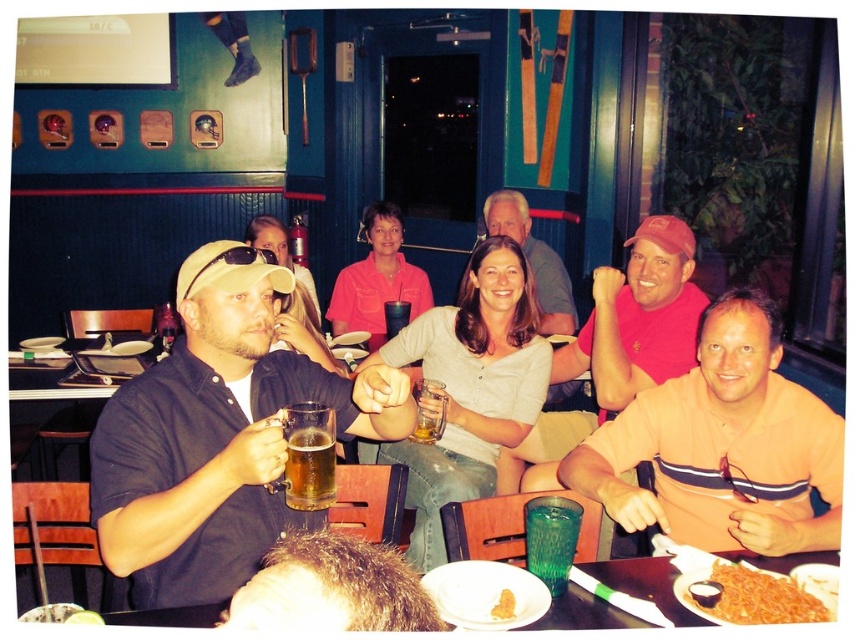
Is the position of plastic disposable plate at lower center less distant than that of translucent plastic cup at center?

Yes, plastic disposable plate at lower center is closer to the viewer.

Does plastic disposable plate at lower center have a smaller size compared to translucent plastic cup at center?

No, plastic disposable plate at lower center is not smaller than translucent plastic cup at center.

Locate an element on the screen. The image size is (855, 640). plastic disposable plate at lower center is located at coordinates (646, 582).

Between point (615, 576) and point (558, 582), which one is positioned behind?

Positioned behind is point (615, 576).

Does plastic disposable plate at lower center have a smaller size compared to green textured glass at center?

Actually, plastic disposable plate at lower center might be larger than green textured glass at center.

Find the location of a particular element. The image size is (855, 640). plastic disposable plate at lower center is located at coordinates (646, 582).

At what (x,y) coordinates should I click in order to perform the action: click on plastic disposable plate at lower center. Please return your answer as a coordinate pair (x, y). Looking at the image, I should click on (646, 582).

Can you confirm if translucent glass mug at center is shorter than yellow matte rice at lower center?

Incorrect, translucent glass mug at center's height does not fall short of yellow matte rice at lower center's.

Does translucent glass mug at center have a greater height compared to yellow matte rice at lower center?

Correct, translucent glass mug at center is much taller as yellow matte rice at lower center.

Is point (298, 461) closer to camera compared to point (508, 589)?

Yes, point (298, 461) is closer to viewer.

Find the location of a particular element. The image size is (855, 640). translucent glass mug at center is located at coordinates (310, 461).